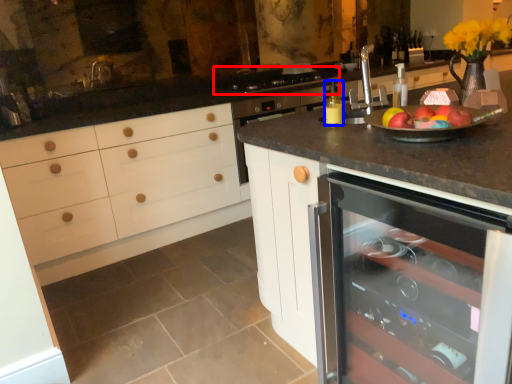
Question: Which of the following is the closest to the observer, gas stove (highlighted by a red box) or bottle (highlighted by a blue box)?

Choices:
 (A) gas stove
 (B) bottle

Answer: (B)